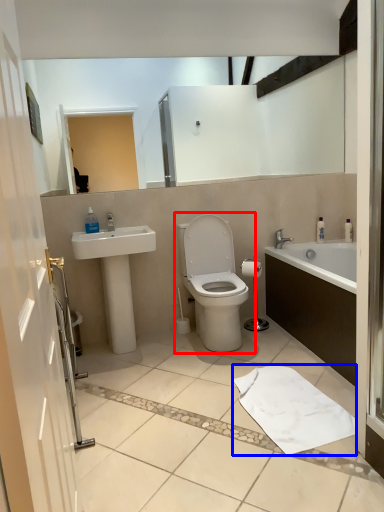
Question: Which point is further to the camera, toilet (highlighted by a red box) or bath towel (highlighted by a blue box)?

Choices:
 (A) toilet
 (B) bath towel

Answer: (A)